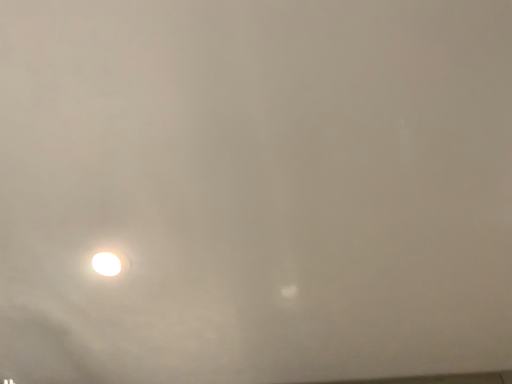
I want to click on white glossy moon at lower left, so click(110, 263).

What do you see at coordinates (110, 263) in the screenshot? I see `white glossy moon at lower left` at bounding box center [110, 263].

Where is `white glossy moon at lower left`? This screenshot has height=384, width=512. white glossy moon at lower left is located at coordinates (110, 263).